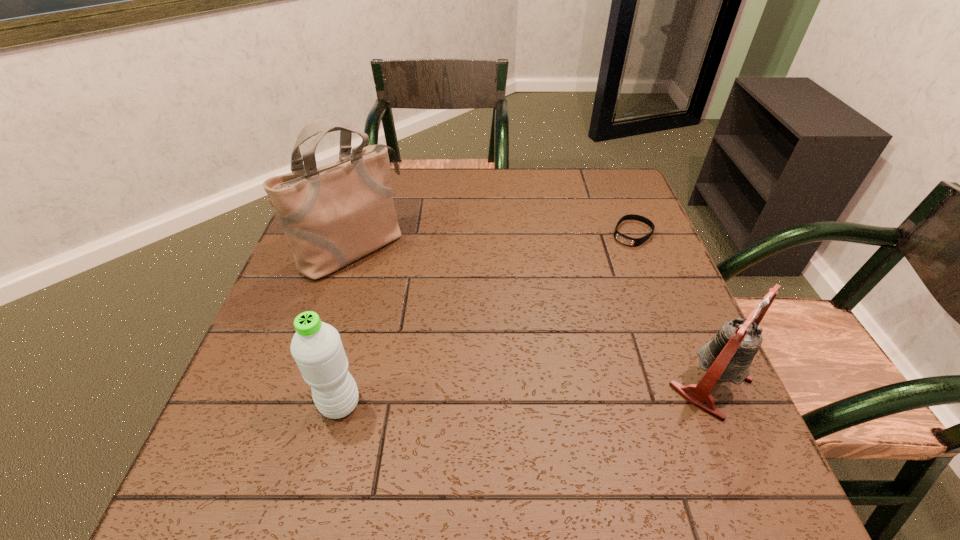
In order to click on free space at the left edge of the desktop in this screenshot , I will do `click(296, 333)`.

Locate an element on the screen. The width and height of the screenshot is (960, 540). vacant space at the right edge of the desktop is located at coordinates point(639,261).

You are a GUI agent. You are given a task and a screenshot of the screen. Output one action in this format:
    pyautogui.click(x=<x>, y=<y>)
    Task: Click on the free space at the near left corner
    The width and height of the screenshot is (960, 540).
    Given the screenshot: What is the action you would take?
    pyautogui.click(x=262, y=415)

Find the location of a particular element. vacant space at the far right corner is located at coordinates (639, 207).

Identify the location of vacant area that lies between the tallest object and the water bottle. (347, 326).

The height and width of the screenshot is (540, 960). What are the coordinates of `blank region between the bell and the water bottle` in the screenshot? It's located at (525, 393).

Locate an element on the screen. The height and width of the screenshot is (540, 960). free point between the bell and the tallest object is located at coordinates (532, 316).

Locate an element on the screen. The image size is (960, 540). vacant space in between the bell and the tallest object is located at coordinates (532, 316).

Find the location of a particular element. blank region between the water bottle and the bell is located at coordinates (525, 393).

I want to click on free spot between the bell and the water bottle, so click(x=525, y=393).